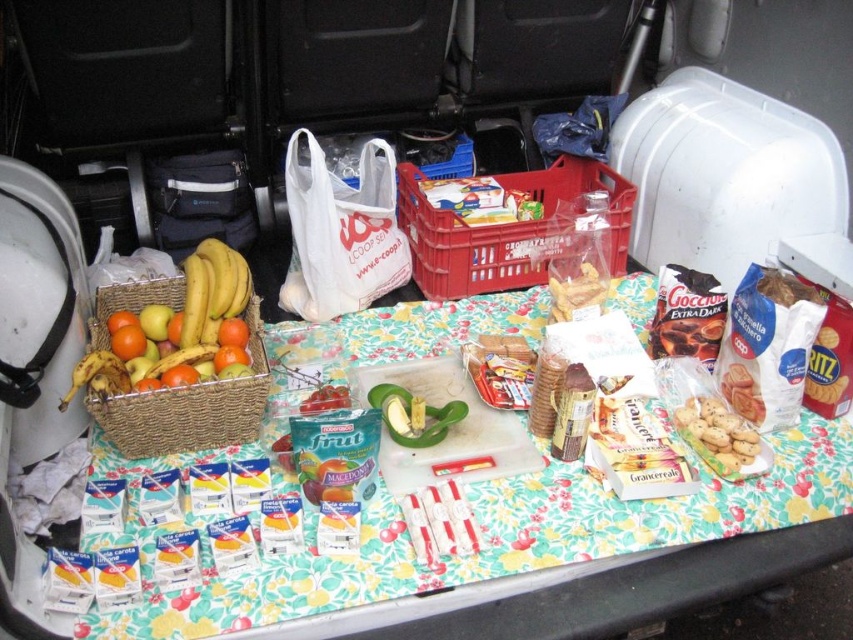
Which of these two, red plastic crate at center or matte brown cookies at center, stands shorter?

With less height is matte brown cookies at center.

Is red plastic crate at center above matte brown cookies at center?

Yes, red plastic crate at center is above matte brown cookies at center.

Is point (451, 291) positioned in front of point (583, 260)?

No, (451, 291) is further to viewer.

Where is `red plastic crate at center`? red plastic crate at center is located at coordinates 503,228.

Which of these two, floral fabric table at center or matte brown cookies at center, stands taller?

floral fabric table at center is taller.

Which is behind, point (801, 461) or point (561, 305)?

The point (561, 305) is more distant.

Is point (656, 540) behind point (575, 307)?

No, (656, 540) is in front of (575, 307).

Identify the location of floral fabric table at center. The height and width of the screenshot is (640, 853). (607, 552).

Locate an element on the screen. woven brown basket at left is located at coordinates (189, 410).

Does woven brown basket at left appear over white textured cookies at center-right?

Yes.

Is point (144, 305) behind point (740, 449)?

Yes, point (144, 305) is behind point (740, 449).

The image size is (853, 640). I want to click on woven brown basket at left, so click(189, 410).